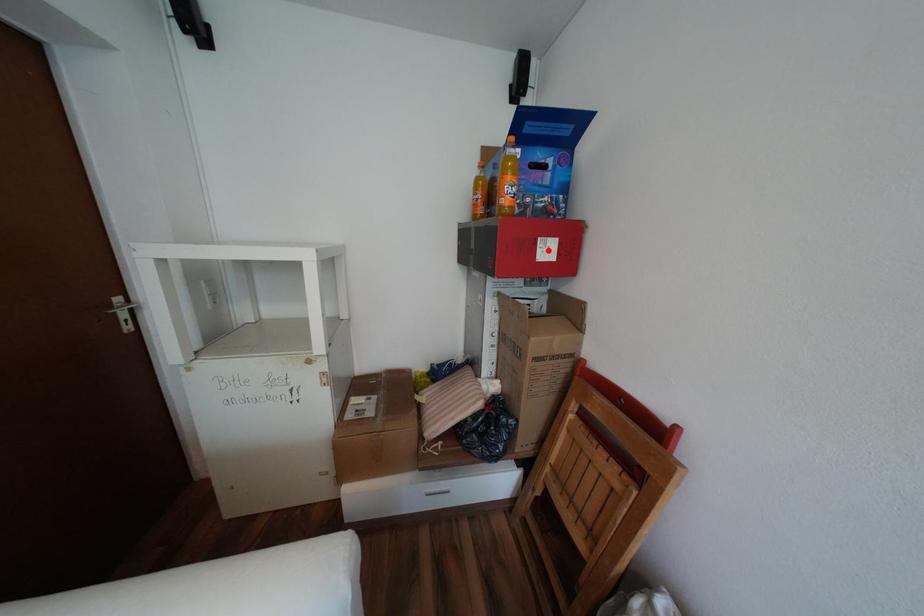
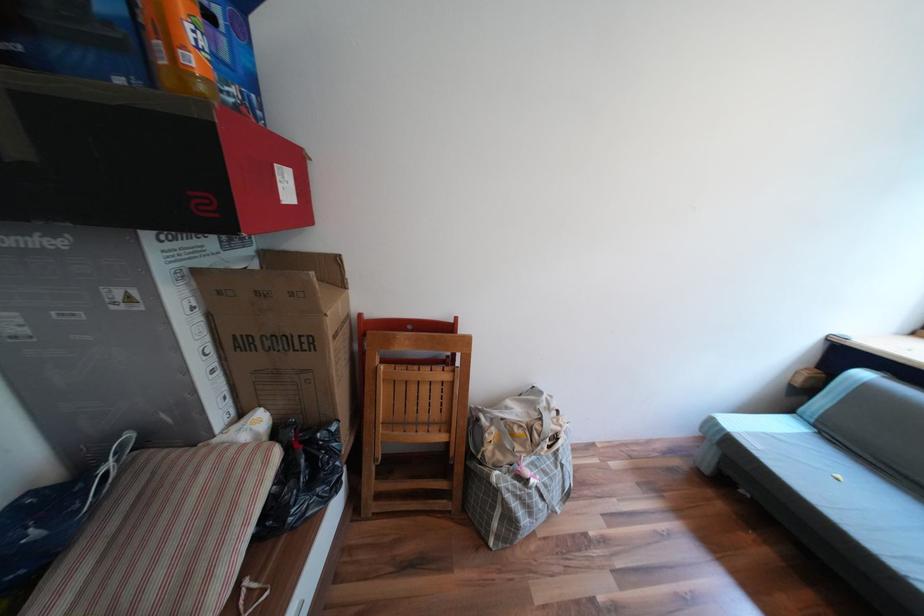
Question: I am providing you with two images of the same scene from different viewpoints. In image1, a red point is highlighted. Considering the same 3D point in image2, which of the following is correct?

Choices:
 (A) It is closer
 (B) It is farther

Answer: (B)